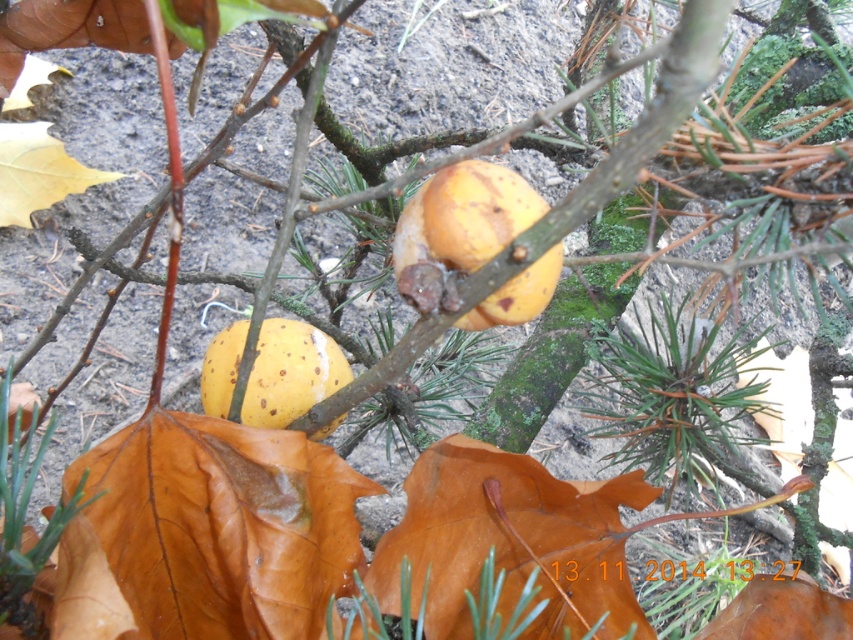
Question: Which point appears farthest from the camera in this image?

Choices:
 (A) (440, 200)
 (B) (277, 428)

Answer: (B)

Question: Does yellow matte fruit at center have a lesser width compared to yellow matte apple at center?

Choices:
 (A) yes
 (B) no

Answer: (A)

Question: Which point is closer to the camera?

Choices:
 (A) yellow matte apple at center
 (B) yellow matte fruit at center

Answer: (B)

Question: Is yellow matte fruit at center further to camera compared to yellow matte apple at center?

Choices:
 (A) yes
 (B) no

Answer: (B)

Question: Which point is closer to the camera?

Choices:
 (A) yellow matte fruit at center
 (B) yellow matte apple at center

Answer: (A)

Question: Can you confirm if yellow matte fruit at center is bigger than yellow matte apple at center?

Choices:
 (A) yes
 (B) no

Answer: (B)